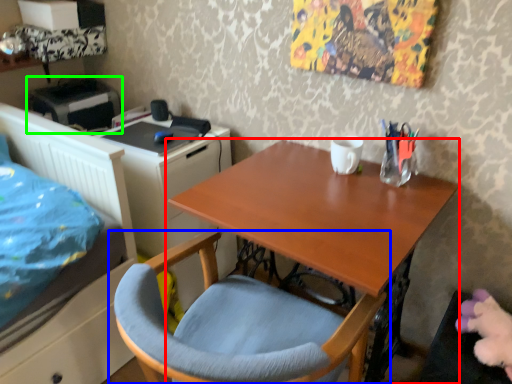
Question: Considering the real-world distances, which object is farthest from desk (highlighted by a red box)? chair (highlighted by a blue box) or printer (highlighted by a green box)?

Choices:
 (A) chair
 (B) printer

Answer: (B)